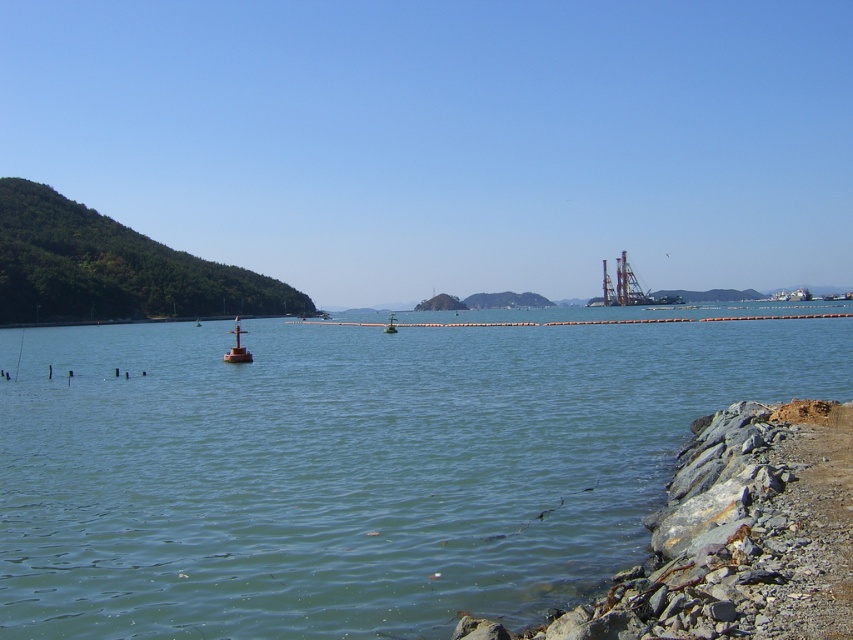
Which of these two, metallic gray drilling rig at center right or green matte buoy at center, stands taller?

Standing taller between the two is metallic gray drilling rig at center right.

Identify the location of metallic gray drilling rig at center right. The width and height of the screenshot is (853, 640). (625, 289).

Does point (256, 509) come in front of point (381, 330)?

Yes.

Is green water at center closer to the viewer compared to green matte buoy at center?

Yes.

Where is `green water at center`? This screenshot has width=853, height=640. green water at center is located at coordinates coord(355,468).

In the scene shown: Who is positioned more to the right, green water at center or smooth orange buoy at center?

green water at center is more to the right.

Which is below, green water at center or smooth orange buoy at center?

smooth orange buoy at center

Image resolution: width=853 pixels, height=640 pixels. Find the location of `green water at center`. green water at center is located at coordinates (355, 468).

I want to click on green water at center, so click(355, 468).